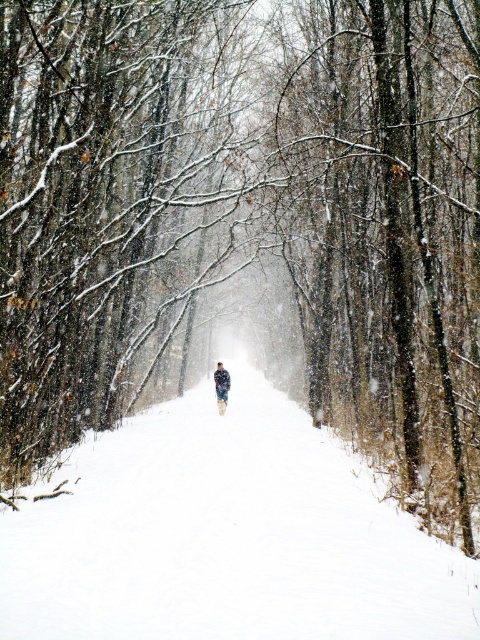
Question: Is white fluffy snow at center thinner than fluffy white snowsuit at center?

Choices:
 (A) yes
 (B) no

Answer: (B)

Question: Can you confirm if white fluffy snow at center is positioned to the left of fluffy white snowsuit at center?

Choices:
 (A) yes
 (B) no

Answer: (B)

Question: Does white fluffy snow at center appear on the left side of fluffy white snowsuit at center?

Choices:
 (A) yes
 (B) no

Answer: (B)